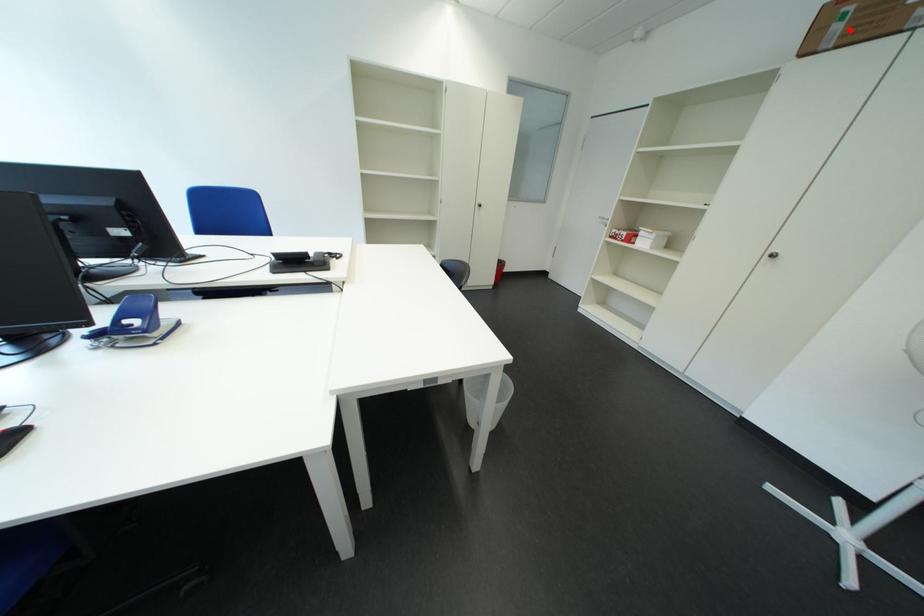
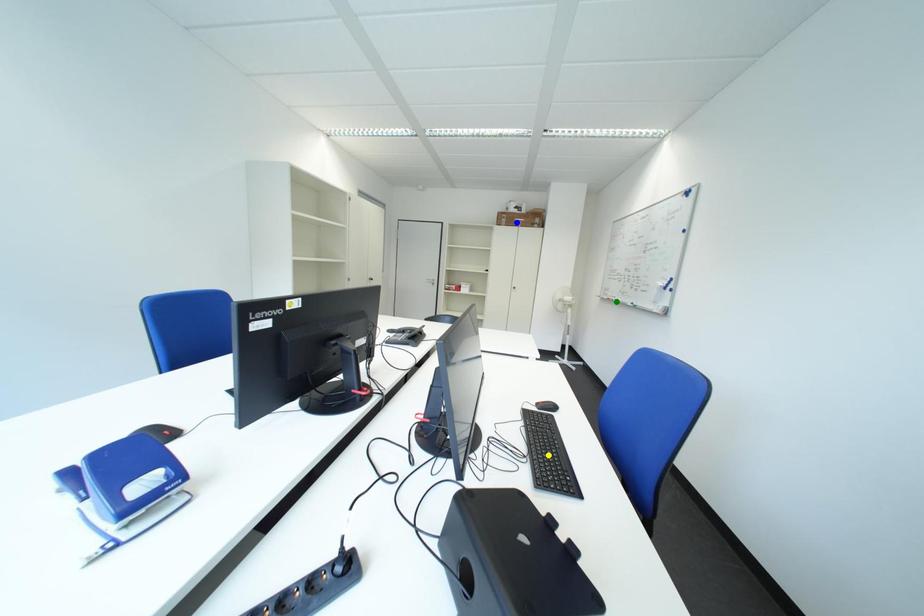
Question: I am providing you with two images of the same scene from different viewpoints. A red point is marked on the first image. You are given multiple points on the second image. In image 2, which mark is for the same physical point as the one in image 1?

Choices:
 (A) green point
 (B) yellow point
 (C) blue point

Answer: (C)